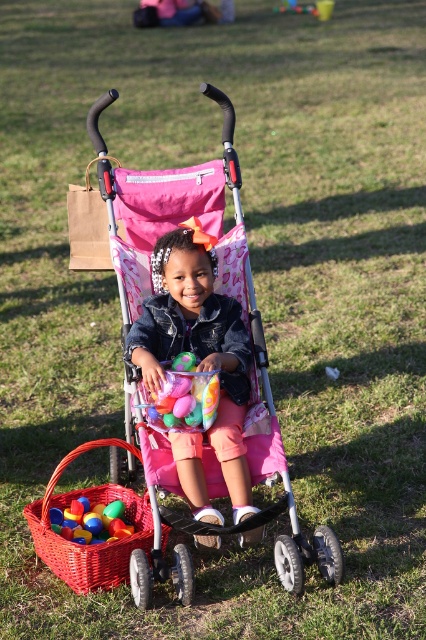
What is located at the coordinate point (184, 396) in the image?

The coordinate point (184, 396) marks the location of the translucent plastic eggs at center.